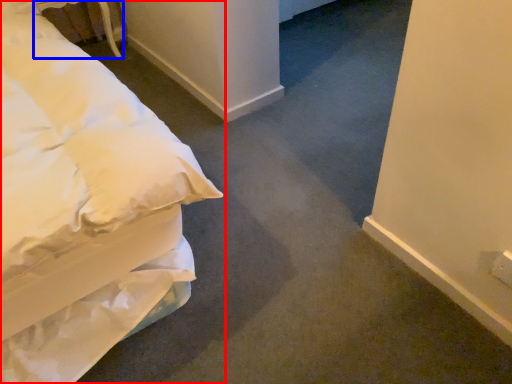
Question: Which point is closer to the camera, bed (highlighted by a red box) or table (highlighted by a blue box)?

Choices:
 (A) bed
 (B) table

Answer: (A)